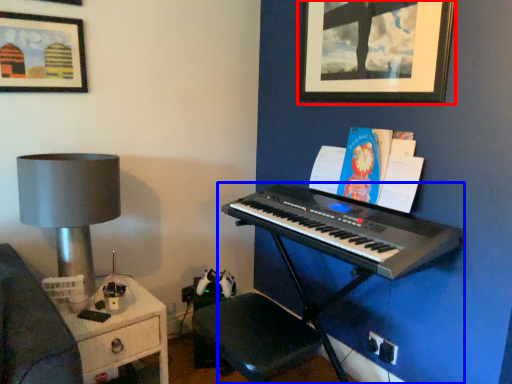
Question: Which object is further to the camera taking this photo, picture frame (highlighted by a red box) or piano (highlighted by a blue box)?

Choices:
 (A) picture frame
 (B) piano

Answer: (A)